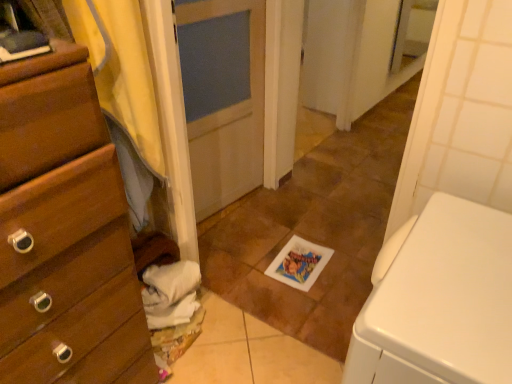
What is the approximate height of yellow fabric at left?

yellow fabric at left is 79.73 centimeters tall.

What do you see at coordinates (172, 309) in the screenshot? I see `white cotton towels at lower left` at bounding box center [172, 309].

Locate an element on the screen. The image size is (512, 384). white cotton towels at lower left is located at coordinates (172, 309).

What do you see at coordinates (64, 233) in the screenshot? I see `wooden chest of drawers at left` at bounding box center [64, 233].

Identify the location of white glossy tile at center. click(314, 229).

Identify the location of yellow fabric at left. (124, 94).

Considering the sizes of objects yellow fabric at left and white glossy tile at center in the image provided, who is bigger, yellow fabric at left or white glossy tile at center?

white glossy tile at center is bigger.

Is yellow fabric at left facing towards white glossy tile at center?

No, yellow fabric at left is not aimed at white glossy tile at center.

In terms of width, does yellow fabric at left look wider or thinner when compared to white glossy tile at center?

Considering their sizes, yellow fabric at left looks slimmer than white glossy tile at center.

Is yellow fabric at left in front of or behind white glossy tile at center in the image?

yellow fabric at left is in front of white glossy tile at center.

From a real-world perspective, is white glossy tile at center positioned under yellow fabric at left based on gravity?

Correct, in the physical world, white glossy tile at center is lower than yellow fabric at left.

How far apart are white glossy tile at center and yellow fabric at left?

white glossy tile at center is 36.15 inches from yellow fabric at left.

Would you say white glossy tile at center is inside or outside yellow fabric at left?

white glossy tile at center exists outside the volume of yellow fabric at left.

Could you tell me if white glossy tile at center is facing yellow fabric at left?

No.

Is wooden chest of drawers at left thinner than yellow fabric at left?

No, wooden chest of drawers at left is not thinner than yellow fabric at left.

Can you confirm if wooden chest of drawers at left is positioned to the right of yellow fabric at left?

No, wooden chest of drawers at left is not to the right of yellow fabric at left.

Can you confirm if wooden chest of drawers at left is taller than yellow fabric at left?

Yes.

Between point (98, 271) and point (123, 157), which one is positioned behind?

The point (123, 157) is farther.

You are a GUI agent. You are given a task and a screenshot of the screen. Output one action in this format:
    pyautogui.click(x=<x>, y=<y>)
    Task: Click on the laundry to the left of white glossy tile at center
    
    Given the screenshot: What is the action you would take?
    pyautogui.click(x=172, y=309)

Looking at this image, how many degrees apart are the facing directions of white cotton towels at lower left and white glossy tile at center?

The facing directions of white cotton towels at lower left and white glossy tile at center are 177 degrees apart.

From the image's perspective, which one is positioned higher, white cotton towels at lower left or white glossy tile at center?

white glossy tile at center appears higher in the image.

Is white cotton towels at lower left not near white glossy tile at center?

white cotton towels at lower left is near white glossy tile at center, not far away.

In terms of width, does white cotton towels at lower left look wider or thinner when compared to yellow fabric at left?

Considering their sizes, white cotton towels at lower left looks broader than yellow fabric at left.

Between point (172, 361) and point (146, 154), which one is positioned behind?

The point (172, 361) is farther.

From the image's perspective, between white cotton towels at lower left and yellow fabric at left, who is located below?

From the image's view, white cotton towels at lower left is below.

Considering the sizes of objects white cotton towels at lower left and yellow fabric at left in the image provided, who is smaller, white cotton towels at lower left or yellow fabric at left?

With smaller size is white cotton towels at lower left.

Where is `tile behind the wooden chest of drawers at left`? The width and height of the screenshot is (512, 384). tile behind the wooden chest of drawers at left is located at coordinates (314, 229).

Based on the photo, from the image's perspective, is white glossy tile at center on top of wooden chest of drawers at left?

Yes, from the image's perspective, white glossy tile at center is above wooden chest of drawers at left.

Which of these two, white glossy tile at center or wooden chest of drawers at left, stands shorter?

With less height is white glossy tile at center.

Considering the relative positions of white glossy tile at center and wooden chest of drawers at left in the image provided, is white glossy tile at center to the right of wooden chest of drawers at left from the viewer's perspective?

Indeed, white glossy tile at center is positioned on the right side of wooden chest of drawers at left.

Who is more distant, yellow fabric at left or wooden chest of drawers at left?

Positioned behind is yellow fabric at left.

Would you say yellow fabric at left is a long distance from wooden chest of drawers at left?

That's not correct — yellow fabric at left is a little close to wooden chest of drawers at left.

Is yellow fabric at left oriented towards wooden chest of drawers at left?

No, yellow fabric at left is not turned towards wooden chest of drawers at left.

Is yellow fabric at left thinner than wooden chest of drawers at left?

Yes.

Identify the location of curtain below the white glossy tile at center (from the image's perspective). The height and width of the screenshot is (384, 512). (124, 94).

At what (x,y) coordinates should I click in order to perform the action: click on tile that is above the yellow fabric at left (from the image's perspective). Please return your answer as a coordinate pair (x, y). The height and width of the screenshot is (384, 512). Looking at the image, I should click on (314, 229).

Which object lies further to the anchor point white glossy tile at center, white cotton towels at lower left or yellow fabric at left?

yellow fabric at left.

Which object lies nearer to the anchor point white cotton towels at lower left, yellow fabric at left or white glossy tile at center?

Among the two, yellow fabric at left is located nearer to white cotton towels at lower left.

Based on their spatial positions, is wooden chest of drawers at left or white cotton towels at lower left further from white glossy tile at center?

Based on the image, wooden chest of drawers at left appears to be further to white glossy tile at center.

From the image, which object appears to be farther from white cotton towels at lower left, wooden chest of drawers at left or yellow fabric at left?

The object further to white cotton towels at lower left is wooden chest of drawers at left.

Estimate the real-world distances between objects in this image. Which object is closer to wooden chest of drawers at left, white glossy tile at center or yellow fabric at left?

yellow fabric at left lies closer to wooden chest of drawers at left than the other object.

Estimate the real-world distances between objects in this image. Which object is closer to yellow fabric at left, white cotton towels at lower left or white glossy tile at center?

Among the two, white cotton towels at lower left is located nearer to yellow fabric at left.

Considering their positions, is yellow fabric at left positioned closer to white glossy tile at center than wooden chest of drawers at left?

yellow fabric at left is positioned closer to the anchor white glossy tile at center.

Based on their spatial positions, is yellow fabric at left or white glossy tile at center closer to wooden chest of drawers at left?

yellow fabric at left.

Locate an element on the screen. This screenshot has height=384, width=512. laundry located between yellow fabric at left and white glossy tile at center in the left-right direction is located at coordinates (172, 309).

I want to click on laundry between wooden chest of drawers at left and white glossy tile at center from left to right, so click(x=172, y=309).

Locate an element on the screen. This screenshot has width=512, height=384. curtain located between wooden chest of drawers at left and white cotton towels at lower left in the depth direction is located at coordinates (124, 94).

You are a GUI agent. You are given a task and a screenshot of the screen. Output one action in this format:
    pyautogui.click(x=<x>, y=<y>)
    Task: Click on the curtain located between wooden chest of drawers at left and white glossy tile at center in the left-right direction
    
    Given the screenshot: What is the action you would take?
    pyautogui.click(x=124, y=94)